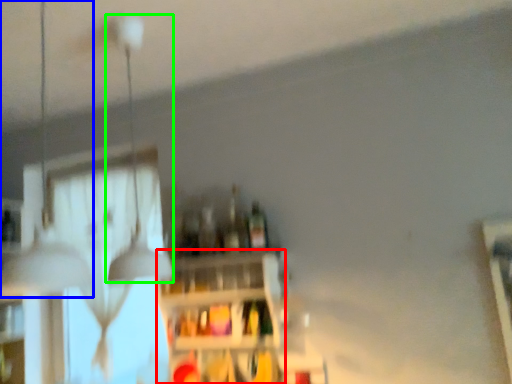
Question: Considering the real-world distances, which object is farthest from shelf (highlighted by a red box)? lamp (highlighted by a blue box) or lamp (highlighted by a green box)?

Choices:
 (A) lamp
 (B) lamp

Answer: (A)